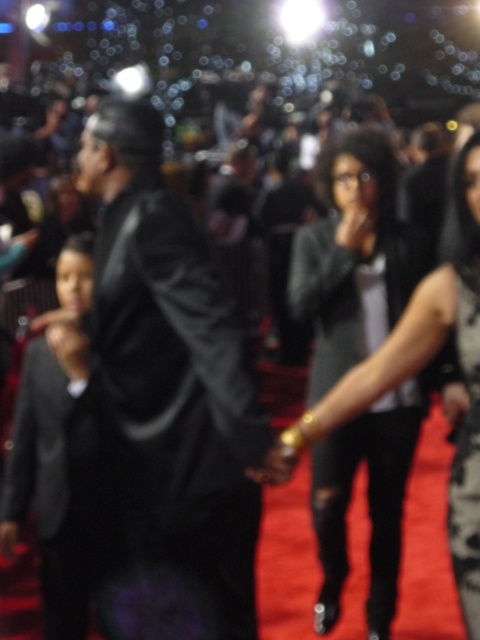
You are a photographer at a red carpet event. You need to adjust your camera settings to focus on the black leather suit at center and the leather jacket at center. According to the scene description, which object is closer to the camera?

The black leather suit at center is positioned over the leather jacket at center, so it is closer to the camera.

Consider the image. You are a photographer at a red carpet event. You want to capture a photo that includes both the black leather suit at center and the black satin dress at lower right. The camera has a maximum focus range of 20 inches. Can you fit both subjects within the camera focus range?

The distance between the black leather suit at center and the black satin dress at lower right is 22.24 inches. Since the camera can only focus within 20 inches, the subjects are slightly out of range. You might need to adjust their positions or use a different camera setting to ensure both are in focus.

You are a photographer at the event and want to ensure both the leather jacket at center and the black satin dress at lower right are clearly visible in your photo. Given their sizes, which object should you focus on first to ensure proper framing?

The leather jacket at center has a larger size compared to the black satin dress at lower right. Therefore, you should focus on the leather jacket at center first to accommodate its larger size within the frame.